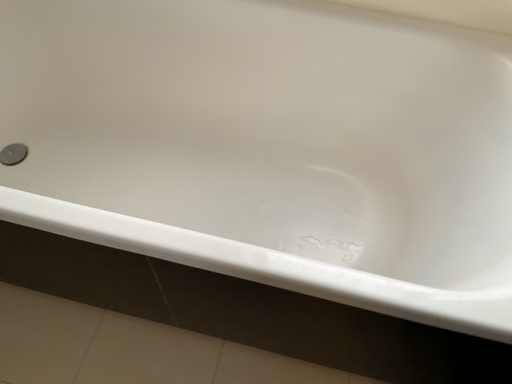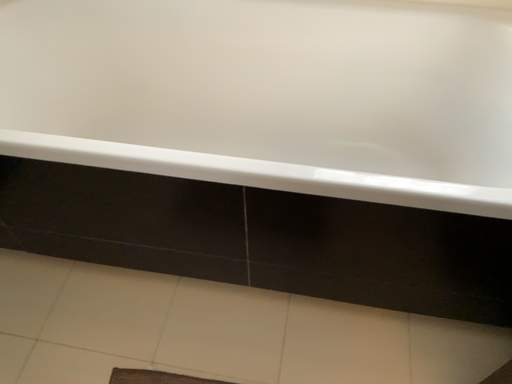
Question: Which way did the camera rotate in the video?

Choices:
 (A) rotated upward
 (B) rotated downward

Answer: (A)